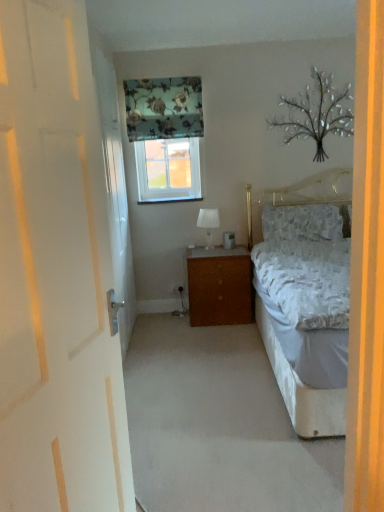
In order to click on vacant area on top of floral fabric curtain at upper center (from a real-world perspective) in this screenshot , I will do `click(159, 71)`.